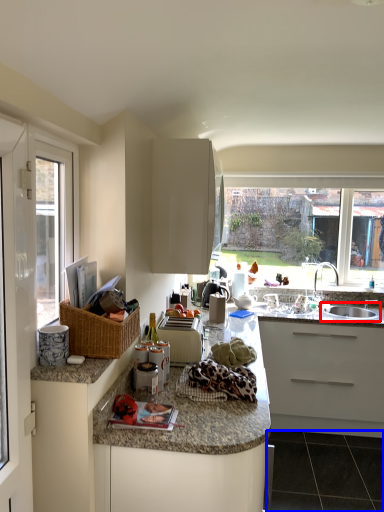
Question: Which point is further to the camera, sink (highlighted by a red box) or granite (highlighted by a blue box)?

Choices:
 (A) sink
 (B) granite

Answer: (A)